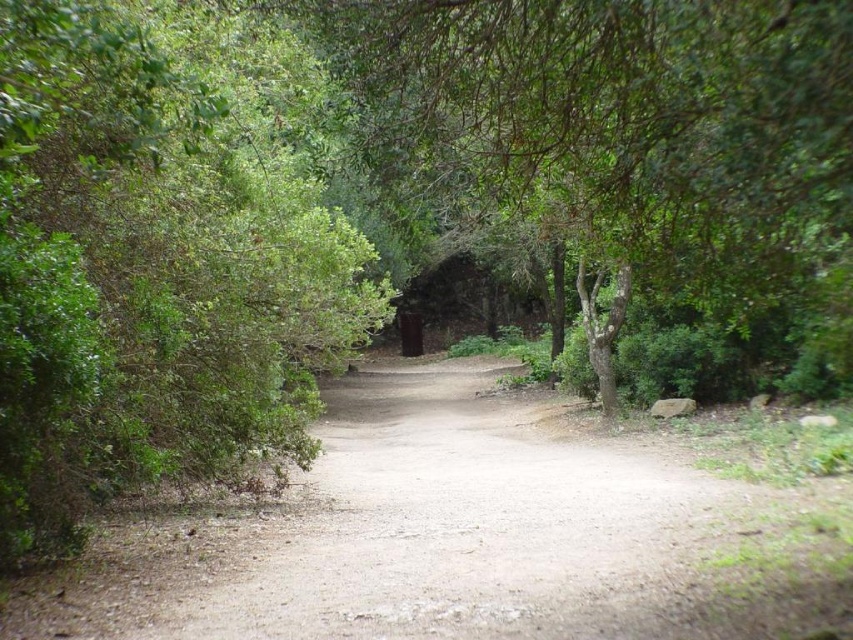
Question: Among these objects, which one is nearest to the camera?

Choices:
 (A) green leafy bush at left
 (B) dirt path at center

Answer: (A)

Question: Does green leafy bush at left have a greater width compared to dirt path at center?

Choices:
 (A) no
 (B) yes

Answer: (A)

Question: Which point appears farthest from the camera in this image?

Choices:
 (A) (171, 467)
 (B) (460, 481)

Answer: (B)

Question: Is green leafy bush at left below dirt path at center?

Choices:
 (A) yes
 (B) no

Answer: (B)

Question: Is green leafy bush at left bigger than dirt path at center?

Choices:
 (A) no
 (B) yes

Answer: (B)